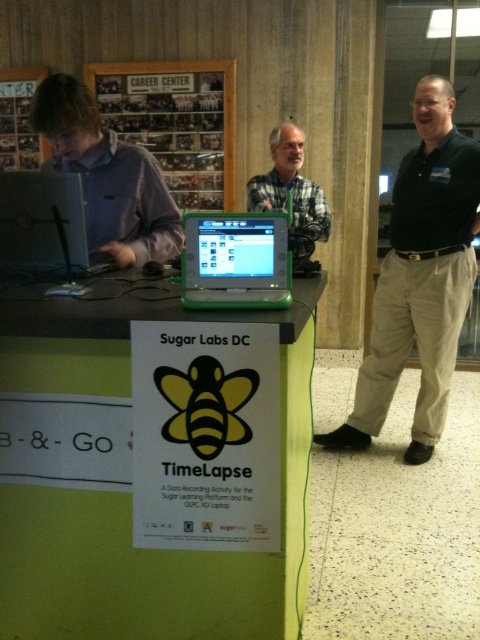
Does point (147, 582) come behind point (273, 220)?

Yes.

Does green plastic table at center have a smaller size compared to green plastic laptop at center?

No.

Is point (192, 403) positioned before point (261, 228)?

Yes, point (192, 403) is closer to viewer.

Identify the location of green plastic table at center. (154, 467).

Is point (266, 198) positioned before point (13, 86)?

Yes, it is.

Is gray flannel shirt at center positioned at the back of metallic silver bulletin board at upper left?

No, it is not.

Which is behind, point (291, 196) or point (4, 132)?

Positioned behind is point (4, 132).

This screenshot has height=640, width=480. Find the location of `gray flannel shirt at center`. gray flannel shirt at center is located at coordinates (291, 193).

Who is more forward, (283, 534) or (12, 116)?

Point (283, 534)

Is green plastic table at center thinner than metallic silver bulletin board at upper left?

No, green plastic table at center is not thinner than metallic silver bulletin board at upper left.

Between point (145, 620) and point (26, 164), which one is positioned in front?

Point (145, 620) is more forward.

Locate an element on the screen. This screenshot has width=480, height=640. green plastic table at center is located at coordinates (154, 467).